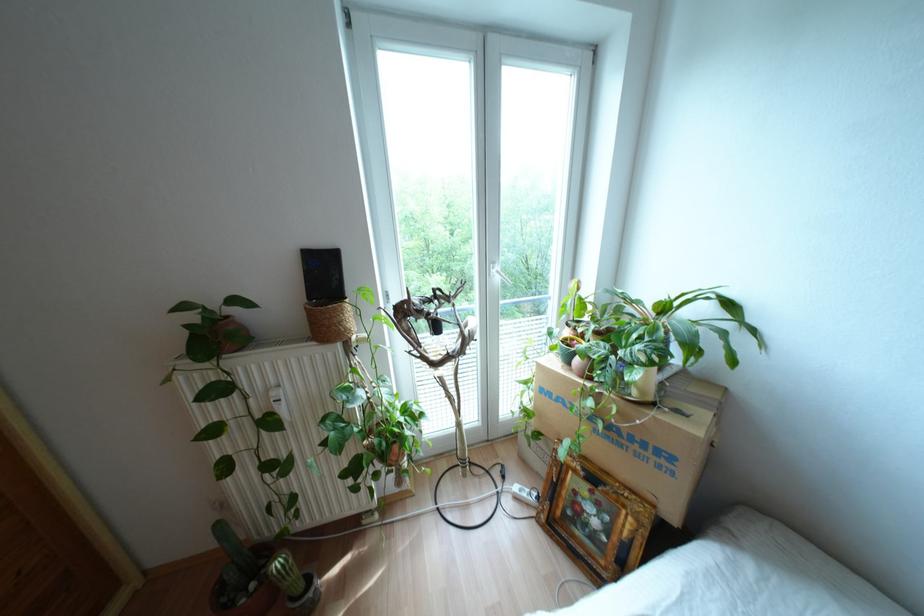
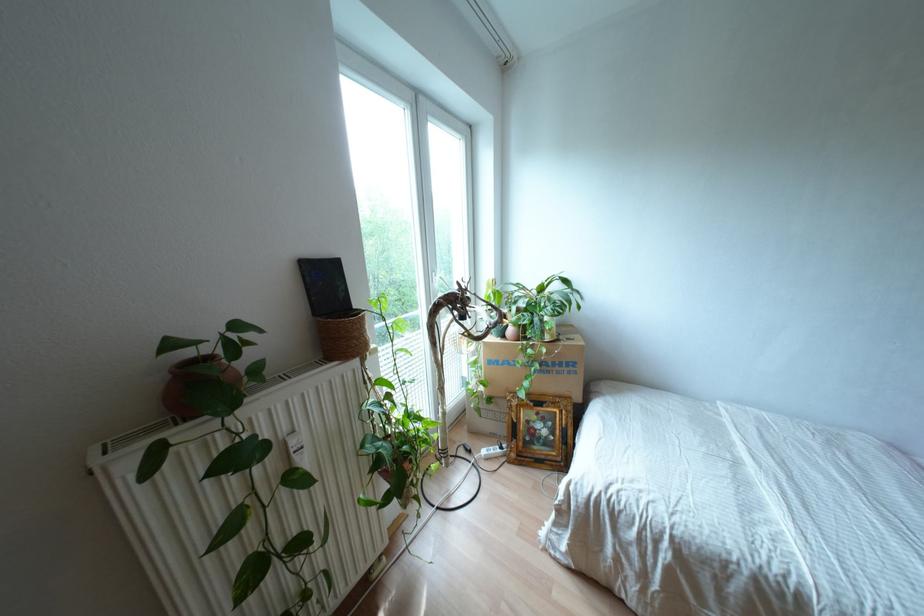
In the second image, find the point that corresponds to point 578,499 in the first image.

(530, 424)